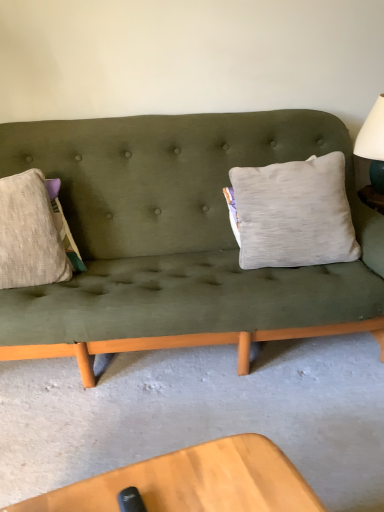
Question: Is gray fabric pillow at center-right placed right next to white matte table lamp at upper right?

Choices:
 (A) no
 (B) yes

Answer: (A)

Question: Considering the relative sizes of gray fabric pillow at center-right and white matte table lamp at upper right in the image provided, is gray fabric pillow at center-right wider than white matte table lamp at upper right?

Choices:
 (A) no
 (B) yes

Answer: (A)

Question: Is gray fabric pillow at center-right further to the viewer compared to white matte table lamp at upper right?

Choices:
 (A) yes
 (B) no

Answer: (B)

Question: Is gray fabric pillow at center-right smaller than white matte table lamp at upper right?

Choices:
 (A) no
 (B) yes

Answer: (A)

Question: Is white matte table lamp at upper right inside gray fabric pillow at center-right?

Choices:
 (A) no
 (B) yes

Answer: (A)

Question: Can you confirm if gray fabric pillow at center-right is bigger than white matte table lamp at upper right?

Choices:
 (A) yes
 (B) no

Answer: (A)

Question: Does white matte table lamp at upper right have a greater width compared to gray fabric pillow at center-right?

Choices:
 (A) no
 (B) yes

Answer: (B)

Question: Does white matte table lamp at upper right have a larger size compared to gray fabric pillow at center-right?

Choices:
 (A) yes
 (B) no

Answer: (B)

Question: Is white matte table lamp at upper right further to the viewer compared to gray fabric pillow at center-right?

Choices:
 (A) yes
 (B) no

Answer: (A)

Question: Does white matte table lamp at upper right have a greater height compared to gray fabric pillow at center-right?

Choices:
 (A) no
 (B) yes

Answer: (A)

Question: From the image's perspective, is white matte table lamp at upper right on top of gray fabric pillow at center-right?

Choices:
 (A) yes
 (B) no

Answer: (A)

Question: From the image's perspective, is white matte table lamp at upper right beneath gray fabric pillow at center-right?

Choices:
 (A) yes
 (B) no

Answer: (B)

Question: Considering the positions of gray fabric pillow at center-right and white matte table lamp at upper right in the image, is gray fabric pillow at center-right taller or shorter than white matte table lamp at upper right?

Choices:
 (A) short
 (B) tall

Answer: (B)